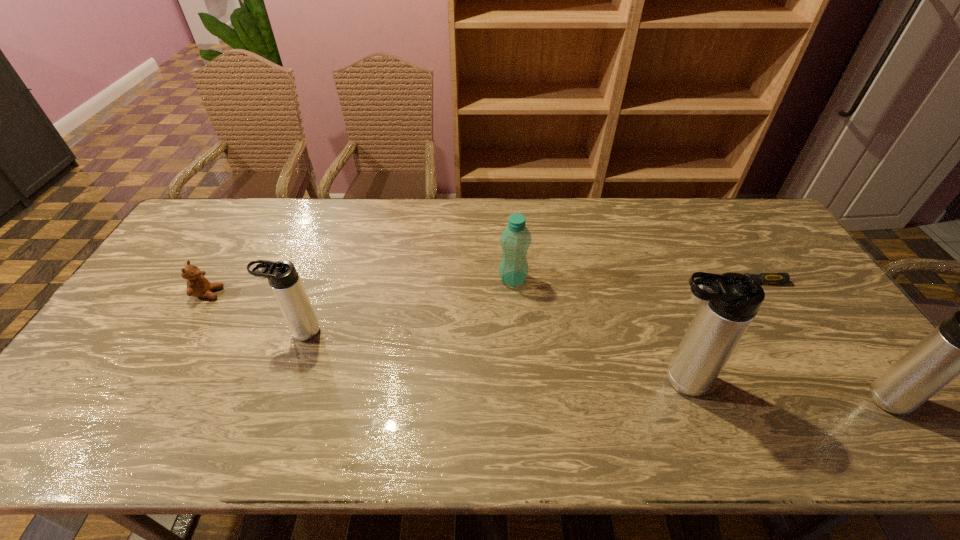
To make them evenly spaced by inserting another thermos_bottle among them, please locate a free space for this new thermos_bottle. Please provide its 2D coordinates. Your answer should be formatted as a tuple, i.e. [(x, y)], where the tuple contains the x and y coordinates of a point satisfying the conditions above.

[(480, 355)]